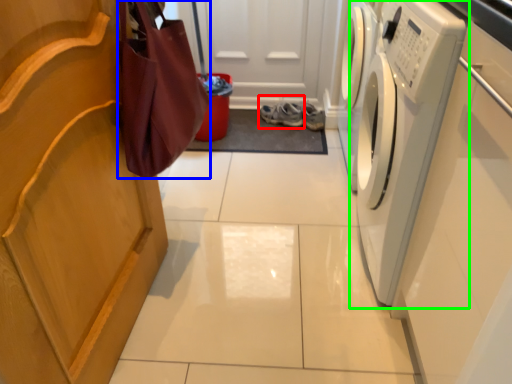
Question: Based on their relative distances, which object is farther from footwear (highlighted by a red box)? Choose from shopping bag (highlighted by a blue box) and washing machine (highlighted by a green box).

Choices:
 (A) shopping bag
 (B) washing machine

Answer: (A)